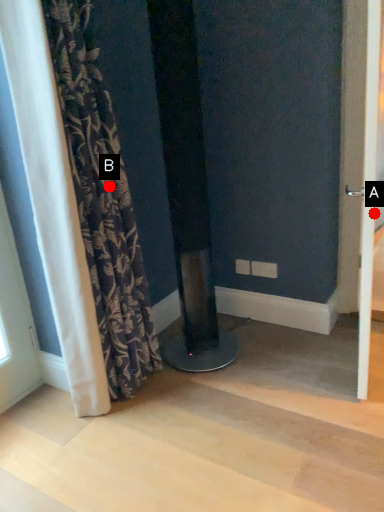
Question: Two points are circled on the image, labeled by A and B beside each circle. Which of the following is the farthest from the observer?

Choices:
 (A) A is further
 (B) B is further

Answer: (A)